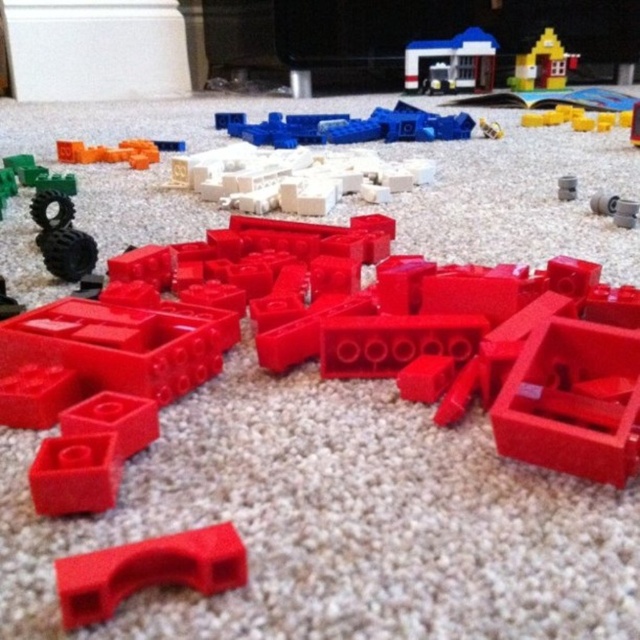
You are playing with the building blocks and want to place a new block between the two points, point (518,68) and point (125,161). Which point should you place the new block closer to so it stays in front of the other point?

You should place the new block closer to point (125,161) because point (518,68) is behind point (125,161). Placing it near the front point keeps it visible.

You are looking at a collection of colorful plastic building blocks on a carpet. There are two points marked in the image, point (216,576) and point (140,147). Which point is closer to you?

Point (216,576) is closer to the viewer than point (140,147).

You are a child who wants to build a tower using the matte plastic arch at center and the matte plastic house at upper right. Which object should you pick up first to start building your tower?

You should pick up the matte plastic arch at center first because it is closer to you than the matte plastic house at upper right, so it is easier to reach.